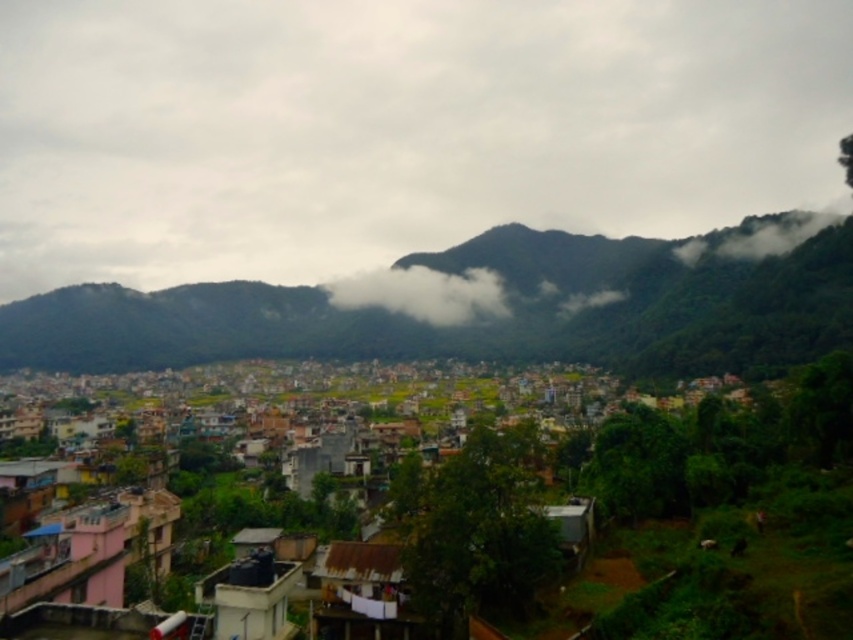
Can you confirm if green forested mountain at center is wider than green leafy cloud at upper right?

Indeed, green forested mountain at center has a greater width compared to green leafy cloud at upper right.

Who is more distant from viewer, (660, 284) or (827, 220)?

The point (660, 284) is behind.

You are a GUI agent. You are given a task and a screenshot of the screen. Output one action in this format:
    pyautogui.click(x=<x>, y=<y>)
    Task: Click on the green forested mountain at center
    This screenshot has height=640, width=853.
    Given the screenshot: What is the action you would take?
    pyautogui.click(x=486, y=317)

Does multicolored buildings at center come behind green leafy cloud at upper right?

No, multicolored buildings at center is closer to the viewer.

Describe the element at coordinates (338, 433) in the screenshot. I see `multicolored buildings at center` at that location.

Is point (438, 438) less distant than point (770, 237)?

That is True.

Identify the location of multicolored buildings at center. This screenshot has width=853, height=640. (338, 433).

This screenshot has width=853, height=640. What do you see at coordinates (338, 433) in the screenshot?
I see `multicolored buildings at center` at bounding box center [338, 433].

The width and height of the screenshot is (853, 640). Find the location of `multicolored buildings at center`. multicolored buildings at center is located at coordinates (338, 433).